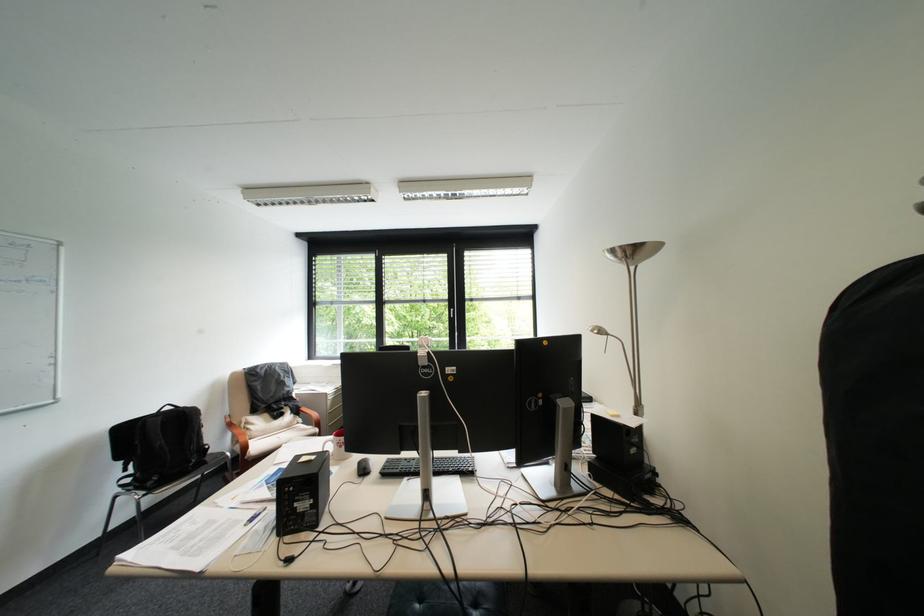
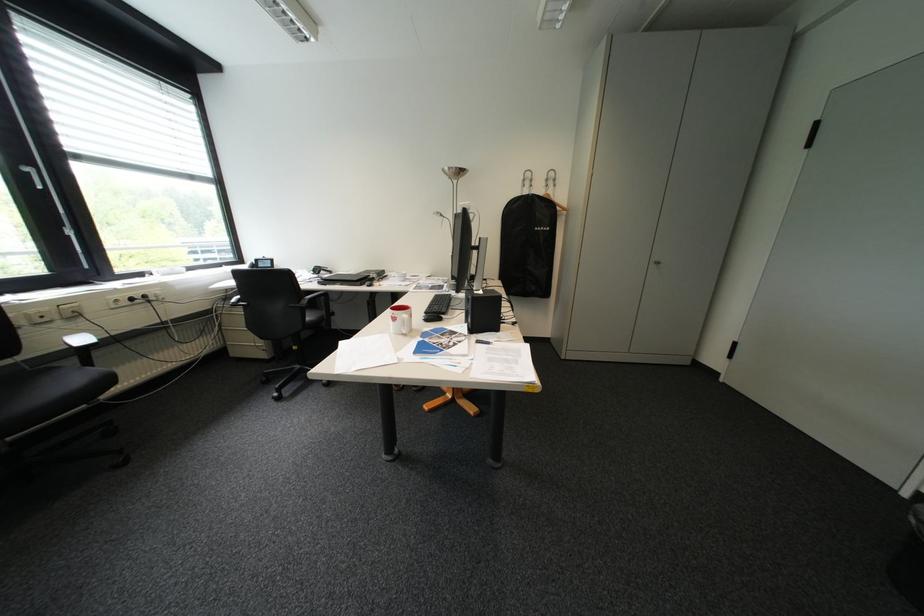
Find the pixel in the second image that matches (465,310) in the first image.

(41, 169)